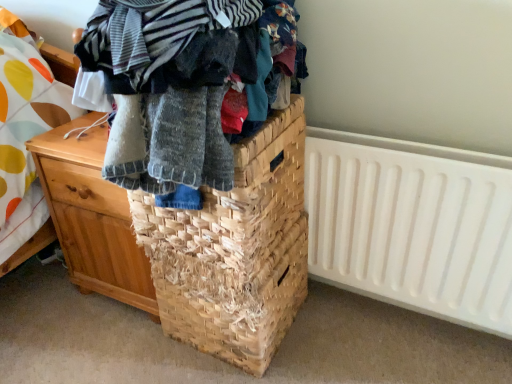
Question: Relative to knitted wool sweater at center, is wooden chest of drawers at left in front or behind?

Choices:
 (A) front
 (B) behind

Answer: (B)

Question: Considering the positions of point (147, 259) and point (132, 142), is point (147, 259) closer or farther from the camera than point (132, 142)?

Choices:
 (A) farther
 (B) closer

Answer: (A)

Question: Which object is the farthest from the white plastic radiator at right?

Choices:
 (A) knitted wool sweater at center
 (B) wooden chest of drawers at left
 (C) natural fiber basket at center

Answer: (B)

Question: Which object is the closest to the white plastic radiator at right?

Choices:
 (A) wooden chest of drawers at left
 (B) knitted wool sweater at center
 (C) natural fiber basket at center

Answer: (C)